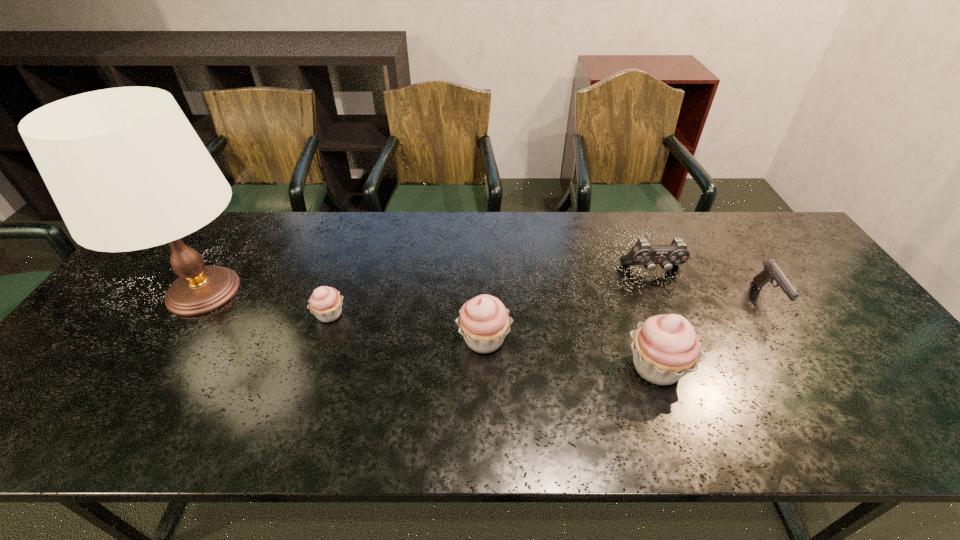
In the current image, all cupcakes are evenly spaced. To maintain this equal spacing, where should an additional cupcake be placed on the right? Please point out a free spot. Please provide its 2D coordinates. Your answer should be formatted as a tuple, i.e. [(x, y)], where the tuple contains the x and y coordinates of a point satisfying the conditions above.

[(852, 399)]